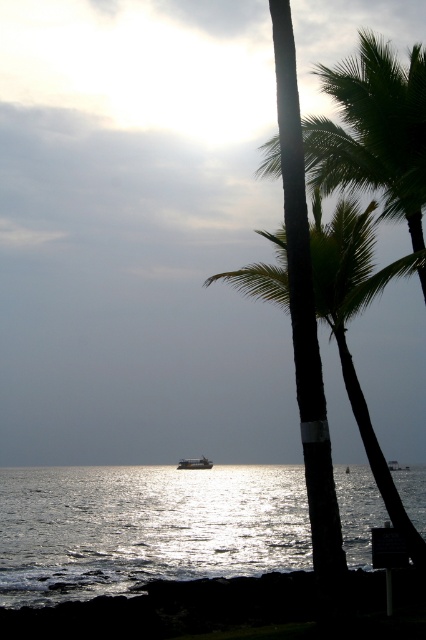
Does shiny reflective water at center appear on the left side of green leafy palm tree at upper right?

Yes, shiny reflective water at center is to the left of green leafy palm tree at upper right.

Is point (127, 497) closer to camera compared to point (408, 106)?

No, it is not.

Between point (17, 605) and point (345, 88), which one is positioned behind?

Point (17, 605)

Find the location of a particular element. This screenshot has height=640, width=426. shiny reflective water at center is located at coordinates (144, 528).

Which is in front, point (313, 259) or point (204, 465)?

Point (313, 259) is more forward.

Between point (268, 289) and point (195, 461), which one is positioned in front?

Point (268, 289)

This screenshot has height=640, width=426. In order to click on black smooth palm tree at center in this screenshot , I will do `click(345, 330)`.

Locate an element on the screen. This screenshot has width=426, height=640. shiny reflective water at center is located at coordinates tap(144, 528).

The image size is (426, 640). What do you see at coordinates (144, 528) in the screenshot?
I see `shiny reflective water at center` at bounding box center [144, 528].

Image resolution: width=426 pixels, height=640 pixels. Find the location of `shiny reflective water at center`. shiny reflective water at center is located at coordinates (144, 528).